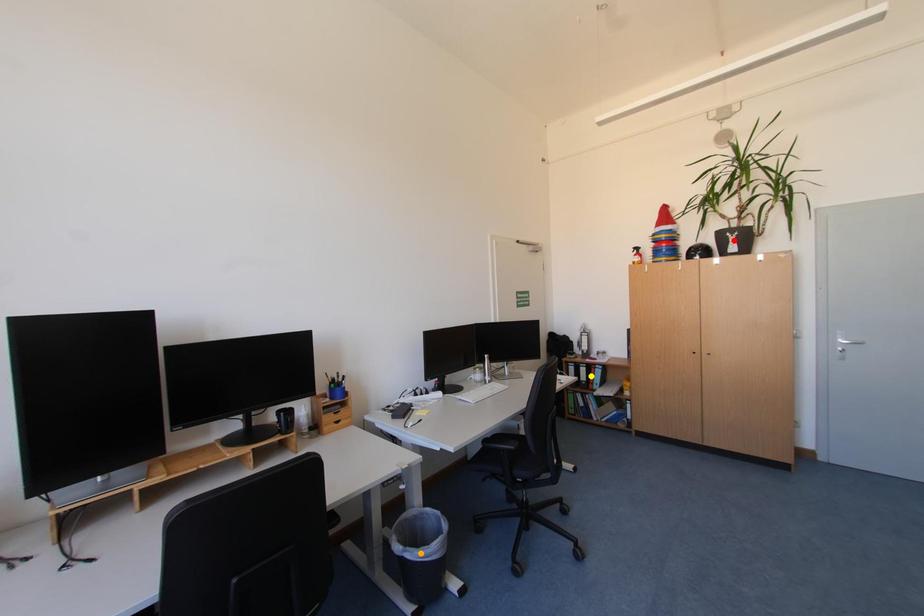
Order these from farthest to nearest:
1. yellow point
2. orange point
3. red point

yellow point
red point
orange point